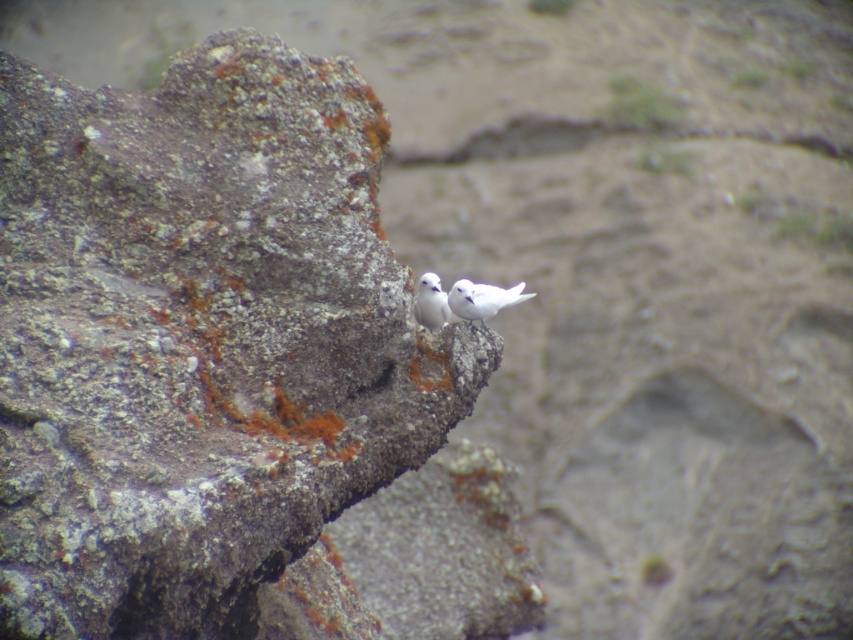
Looking at this image, does rusty stone boulder at center come in front of white matte bird at center?

Yes.

Who is more forward, (273, 376) or (448, 298)?

Point (273, 376)

Locate an element on the screen. rusty stone boulder at center is located at coordinates (198, 339).

Between point (461, 308) and point (434, 273), which one is positioned behind?

Point (434, 273)

Which of these two, white matte bird at center or white feathered bird at center, stands taller?

Standing taller between the two is white feathered bird at center.

Is point (503, 292) closer to camera compared to point (445, 316)?

No, (503, 292) is behind (445, 316).

Where is `white matte bird at center`? This screenshot has height=640, width=853. white matte bird at center is located at coordinates (482, 298).

Consider the image. Does rusty stone boulder at center have a lesser width compared to white feathered bird at center?

No, rusty stone boulder at center is not thinner than white feathered bird at center.

Identify the location of rusty stone boulder at center. The image size is (853, 640). (198, 339).

Where is `rusty stone boulder at center`? The width and height of the screenshot is (853, 640). rusty stone boulder at center is located at coordinates (198, 339).